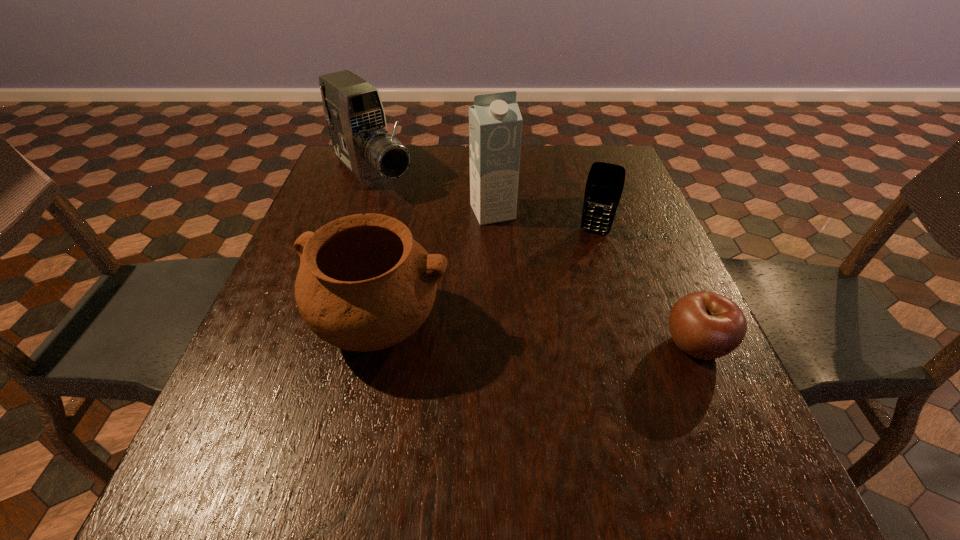
Find the location of a particular element. pottery is located at coordinates (364, 284).

In order to click on the shortest object in this screenshot , I will do `click(706, 325)`.

At what (x,y) coordinates should I click in order to perform the action: click on apple. Please return your answer as a coordinate pair (x, y). Looking at the image, I should click on (706, 325).

Where is `the second tallest object`? Image resolution: width=960 pixels, height=540 pixels. the second tallest object is located at coordinates (353, 109).

Where is `cellular telephone`? The height and width of the screenshot is (540, 960). cellular telephone is located at coordinates (605, 182).

Locate an element on the screen. the tallest object is located at coordinates (495, 123).

I want to click on carton, so click(x=495, y=123).

You are a GUI agent. You are given a task and a screenshot of the screen. Output one action in this format:
    pyautogui.click(x=<x>, y=<y>)
    Task: Click on the vacant space situated on the back of the pottery
    The image size is (960, 540).
    Given the screenshot: What is the action you would take?
    pyautogui.click(x=408, y=195)

Where is `vacant area situated at the front of the second tallest object, highlighting the lens`? The width and height of the screenshot is (960, 540). vacant area situated at the front of the second tallest object, highlighting the lens is located at coordinates (430, 234).

Locate an element on the screen. This screenshot has width=960, height=540. blank space located at the front of the second tallest object, highlighting the lens is located at coordinates (464, 268).